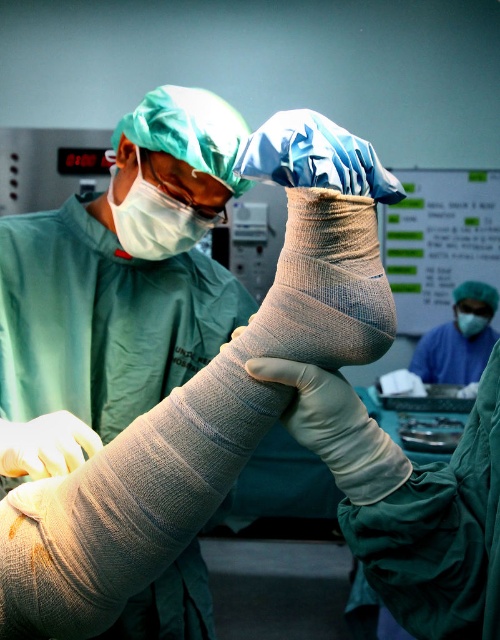
Question: Which of these objects is positioned closest to the smooth beige skin at lower left?

Choices:
 (A) white matte mask at upper left
 (B) matte white mask at center
 (C) gray bandaged arm at center

Answer: (C)

Question: Which point is closer to the camera taking this photo?

Choices:
 (A) (463, 332)
 (B) (70, 429)
 (C) (180, 237)

Answer: (B)

Question: Estimate the real-world distances between objects in this image. Which object is farther from the smooth beige skin at lower left?

Choices:
 (A) matte white mask at center
 (B) gray bandaged arm at center
 (C) white matte mask at upper left

Answer: (A)

Question: Does gray bandaged arm at center appear on the left side of matte white mask at center?

Choices:
 (A) no
 (B) yes

Answer: (B)

Question: Can you confirm if white matte mask at upper left is positioned to the left of smooth beige skin at lower left?

Choices:
 (A) no
 (B) yes

Answer: (A)

Question: Does white matte mask at upper left lie in front of smooth beige skin at lower left?

Choices:
 (A) yes
 (B) no

Answer: (B)